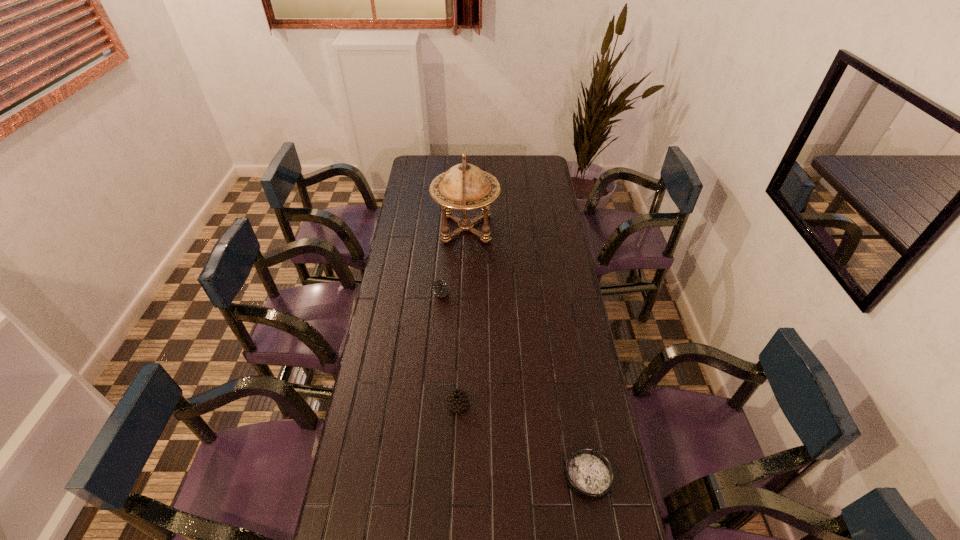
The height and width of the screenshot is (540, 960). Identify the location of vacant space located at the narrow end of the right pinecone. (575, 404).

Locate an element on the screen. free location located on the back of the nearest object is located at coordinates (572, 384).

The width and height of the screenshot is (960, 540). I want to click on object that is at the right edge, so click(x=589, y=473).

Find the location of a particular element. free space at the far edge of the desktop is located at coordinates (450, 166).

The width and height of the screenshot is (960, 540). In order to click on free region at the left edge of the desktop in this screenshot , I will do `click(396, 483)`.

This screenshot has width=960, height=540. Identify the location of blank space at the right edge of the desktop. (572, 285).

This screenshot has width=960, height=540. What are the coordinates of `vacant position at the far right corner of the desktop` in the screenshot? It's located at pyautogui.click(x=522, y=156).

At what (x,y) coordinates should I click in order to perform the action: click on vacant region between the farthest object and the left pinecone. Please return your answer as a coordinate pair (x, y). This screenshot has width=960, height=540. Looking at the image, I should click on (454, 261).

The width and height of the screenshot is (960, 540). What are the coordinates of `vacant area that lies between the tallest object and the second farthest object` in the screenshot? It's located at (454, 261).

Image resolution: width=960 pixels, height=540 pixels. Identify the location of empty space between the farthest object and the right pinecone. (462, 316).